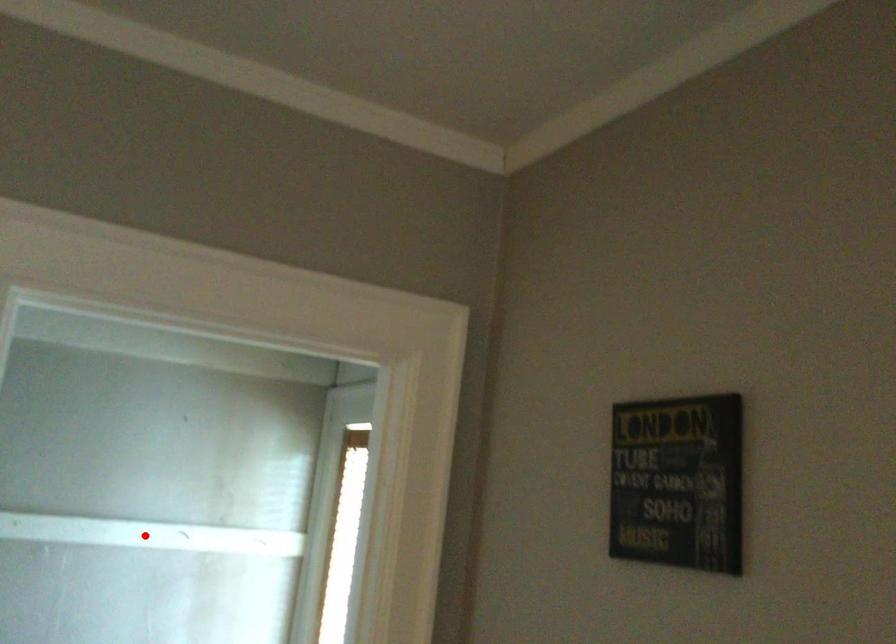
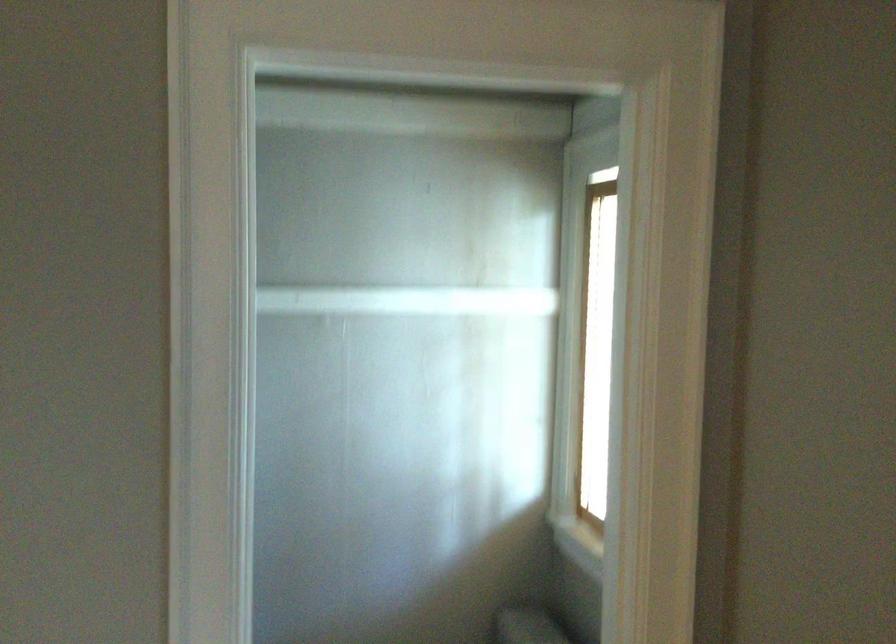
The point at the highlighted location is marked in the first image. Where is the corresponding point in the second image?

(407, 301)